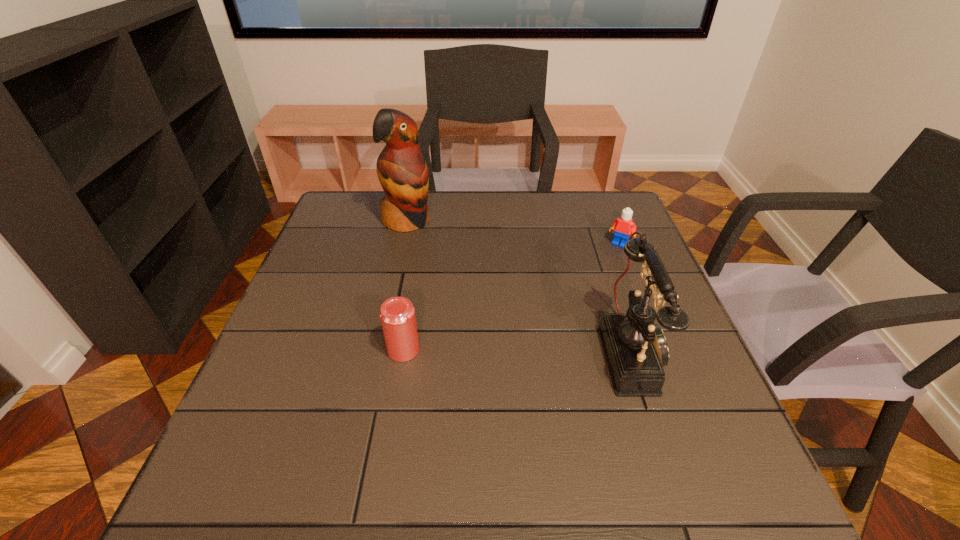
Find the location of a particular element. The height and width of the screenshot is (540, 960). beer can is located at coordinates (397, 314).

Locate an element on the screen. The width and height of the screenshot is (960, 540). telephone is located at coordinates (635, 349).

Find the location of a particular element. the farthest object is located at coordinates (402, 171).

This screenshot has width=960, height=540. I want to click on parrot, so click(x=402, y=171).

Locate an element on the screen. The image size is (960, 540). the third nearest object is located at coordinates (623, 226).

At what (x,y) coordinates should I click in order to perform the action: click on free space located 0.110m on the back of the beer can. Please return your answer as a coordinate pair (x, y). Looking at the image, I should click on (412, 303).

I want to click on free region located on the dial of the third shortest object, so click(683, 352).

The height and width of the screenshot is (540, 960). Find the location of `free point located on the face of the tallest object`. free point located on the face of the tallest object is located at coordinates (456, 273).

Locate an element on the screen. The image size is (960, 540). vacant region located on the face of the tallest object is located at coordinates (432, 247).

The height and width of the screenshot is (540, 960). What are the coordinates of `vacant space located 0.270m on the face of the tallest object` in the screenshot? It's located at (468, 286).